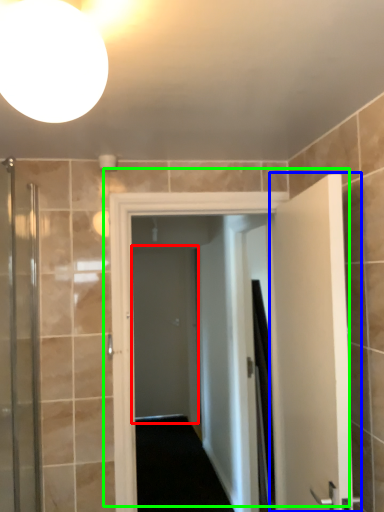
Question: Which is farther away from screen door (highlighted by a red box)? door (highlighted by a blue box) or door (highlighted by a green box)?

Choices:
 (A) door
 (B) door

Answer: (A)